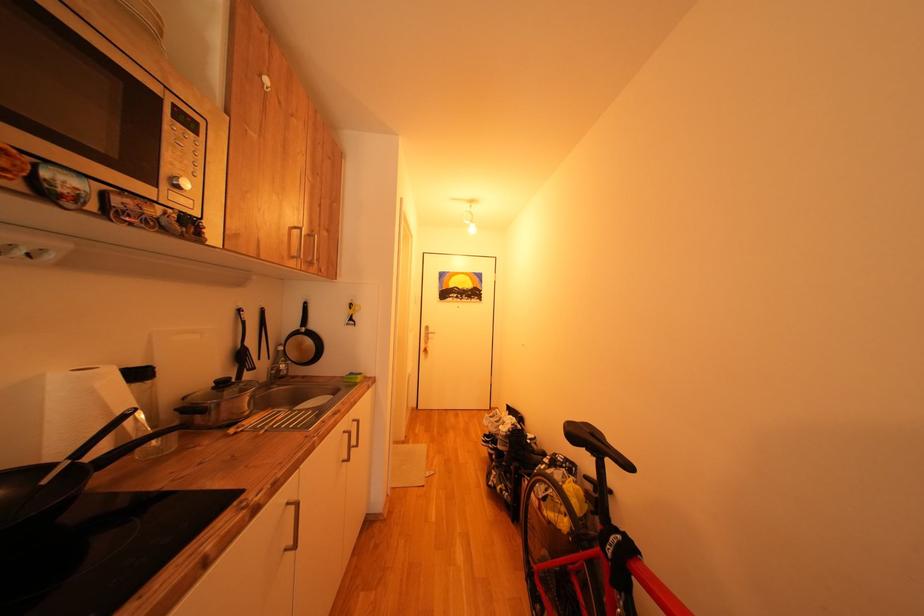
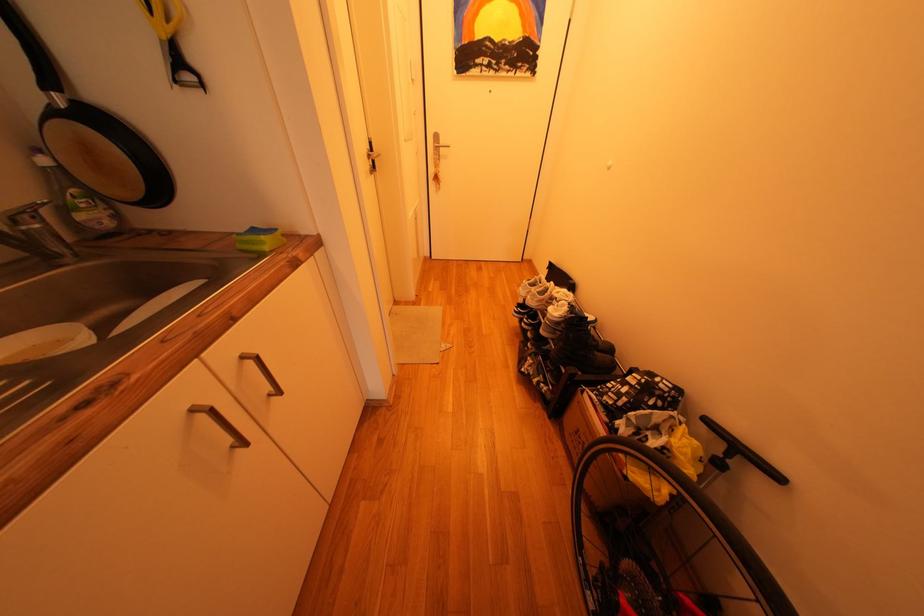
Question: Based on the continuous images, in which direction is the camera rotating? Reply with the corresponding letter.

Choices:
 (A) Left
 (B) Right
 (C) Up
 (D) Down

Answer: (D)